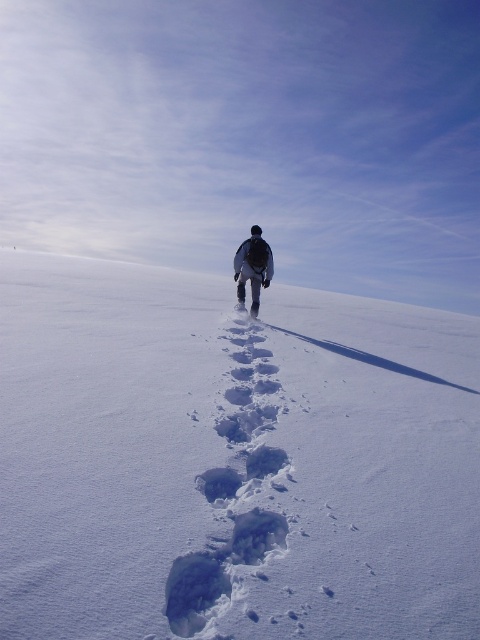
Question: Is white powdery snow at center below dark gray fabric jacket at center?

Choices:
 (A) no
 (B) yes

Answer: (B)

Question: Can you confirm if white powdery snow at center is thinner than dark gray fabric jacket at center?

Choices:
 (A) yes
 (B) no

Answer: (B)

Question: Is white powdery snow at center above dark gray fabric jacket at center?

Choices:
 (A) yes
 (B) no

Answer: (B)

Question: Which object appears closest to the camera in this image?

Choices:
 (A) dark gray fabric jacket at center
 (B) white powdery snow at center

Answer: (B)